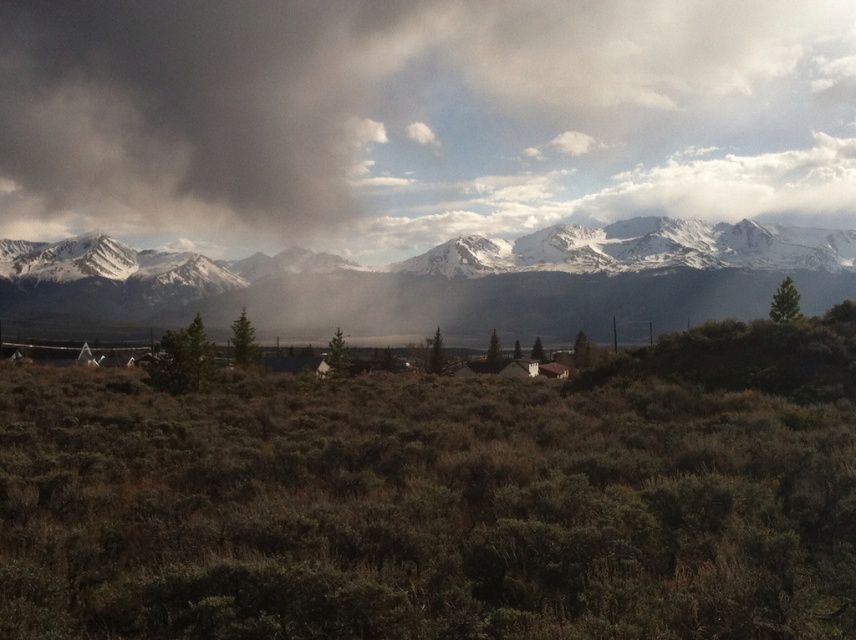
You are standing in the open landscape looking at the dark gray cloud at upper center. If you want to measure how far it is from you, what would the approximate distance be?

The dark gray cloud at upper center is approximately 795.14 feet away from the viewer.

You are an airplane pilot preparing for takeoff at an airport located in this landscape. You notice the dark gray cloud at upper center and the snowy granite mountain range at upper center in your flight path. Which object is more likely to affect your flight path due to its size?

The dark gray cloud at upper center is bigger than the snowy granite mountain range at upper center, so it is more likely to affect the flight path due to its larger size.

You are an airplane pilot preparing to fly over the landscape. You notice the dark gray cloud at upper center and the snowy granite mountain range at upper center. Which one is higher in the sky?

The dark gray cloud at upper center is taller than the snowy granite mountain range at upper center, so the dark gray cloud at upper center is higher in the sky.